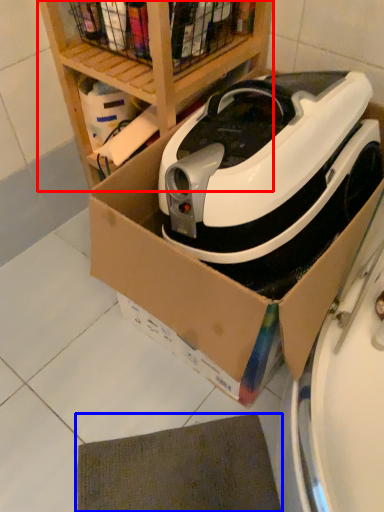
Question: Which of the following is the closest to the observer, shelf (highlighted by a red box) or mat (highlighted by a blue box)?

Choices:
 (A) shelf
 (B) mat

Answer: (A)